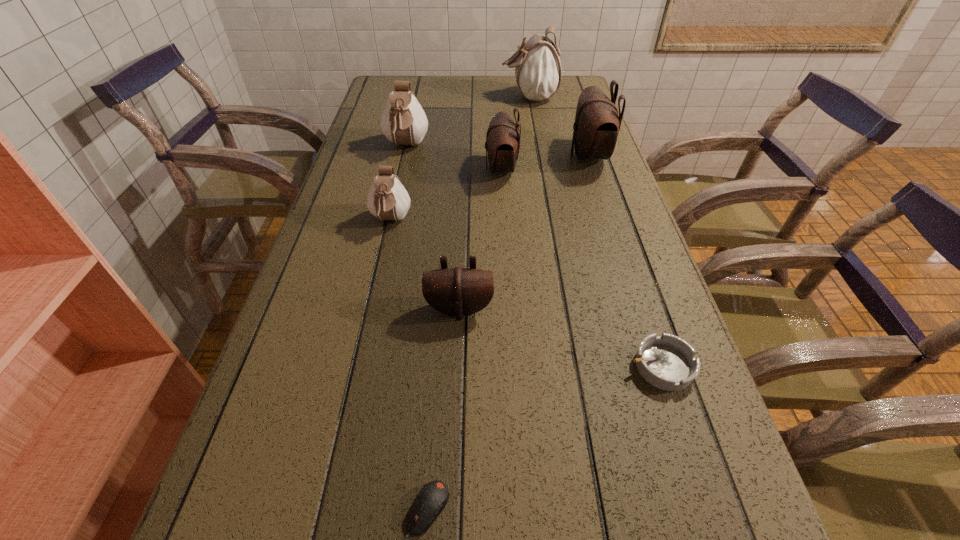
Image resolution: width=960 pixels, height=540 pixels. I want to click on free point located with the flap open on the second smallest brown pouch, so click(453, 169).

You are a GUI agent. You are given a task and a screenshot of the screen. Output one action in this format:
    pyautogui.click(x=<x>, y=<y>)
    Task: Click on the free region located 0.200m on the front-facing side of the nearest white pouch
    The image size is (960, 540).
    Given the screenshot: What is the action you would take?
    pyautogui.click(x=372, y=301)

I want to click on vacant space located with the flap open on the third nearest object, so click(454, 442).

What are the coordinates of `vacant space situated 0.070m on the back of the seventh farthest object` in the screenshot? It's located at (643, 313).

You are a GUI agent. You are given a task and a screenshot of the screen. Output one action in this format:
    pyautogui.click(x=<x>, y=<y>)
    Task: Click on the object present at the far edge
    
    Given the screenshot: What is the action you would take?
    pyautogui.click(x=537, y=65)

Locate an element on the screen. ashtray at the right edge is located at coordinates (667, 362).

This screenshot has height=540, width=960. I want to click on object present at the far right corner, so click(x=537, y=65).

This screenshot has height=540, width=960. In order to click on vacant area at the far edge of the desktop in this screenshot , I will do `click(430, 93)`.

Where is `free space at the left edge of the desktop`? This screenshot has width=960, height=540. free space at the left edge of the desktop is located at coordinates (291, 472).

In the image, there is a desktop. Identify the location of vacant region at the right edge. pos(567,187).